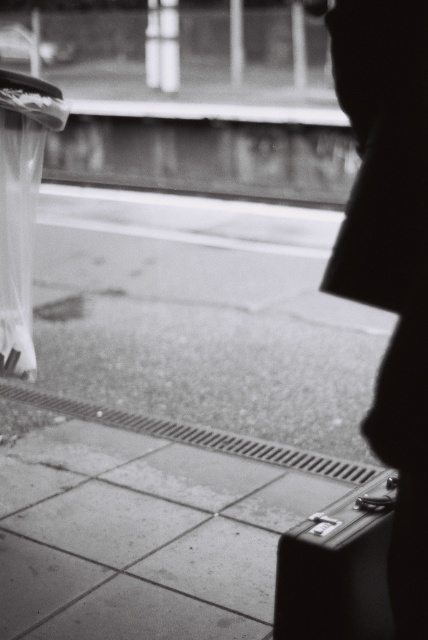
Question: Does metallic suitcase at lower right appear on the right side of transparent nylon umbrella at left?

Choices:
 (A) yes
 (B) no

Answer: (A)

Question: Does metallic suitcase at lower right appear on the left side of transparent nylon umbrella at left?

Choices:
 (A) no
 (B) yes

Answer: (A)

Question: Is metallic suitcase at lower right further to camera compared to transparent nylon umbrella at left?

Choices:
 (A) yes
 (B) no

Answer: (B)

Question: Which point is farther to the camera?

Choices:
 (A) (0, 237)
 (B) (285, 586)

Answer: (A)

Question: Which point is closer to the camera taking this photo?

Choices:
 (A) (344, 534)
 (B) (17, 273)

Answer: (A)

Question: Which of the following is the closest to the observer?

Choices:
 (A) (18, 90)
 (B) (318, 561)

Answer: (B)